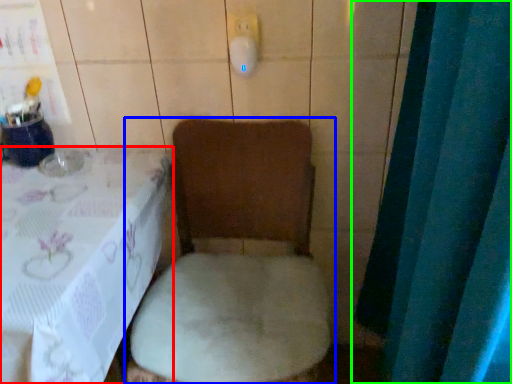
Question: Based on their relative distances, which object is farther from furniture (highlighted by a red box)? Choose from toilet (highlighted by a blue box) and curtain (highlighted by a green box).

Choices:
 (A) toilet
 (B) curtain

Answer: (B)